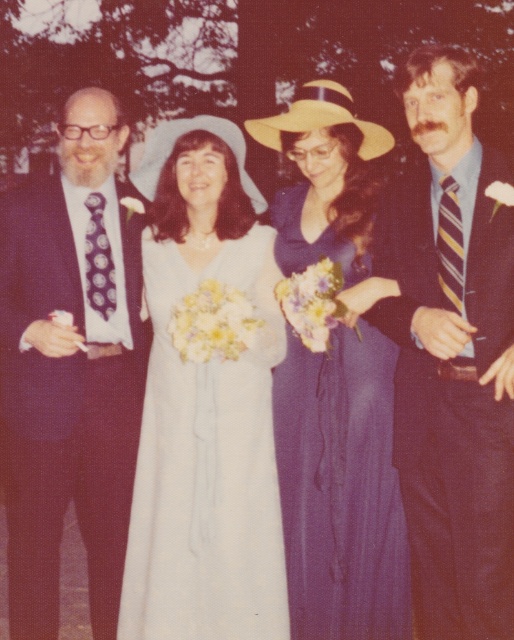
Does striped tie at right have a lesser width compared to matte black suit at left?

Yes, striped tie at right is thinner than matte black suit at left.

Can you confirm if striped tie at right is taller than matte black suit at left?

No, striped tie at right is not taller than matte black suit at left.

Where is `striped tie at right`? The width and height of the screenshot is (514, 640). striped tie at right is located at coordinates (451, 355).

Where is `striped tie at right`? This screenshot has width=514, height=640. striped tie at right is located at coordinates (451, 355).

From the picture: Can you confirm if white satin dress at center is positioned to the right of purple satin dress at center?

Incorrect, white satin dress at center is not on the right side of purple satin dress at center.

Does white satin dress at center have a larger size compared to purple satin dress at center?

Correct, white satin dress at center is larger in size than purple satin dress at center.

Find the location of a particular element. This screenshot has height=640, width=514. white satin dress at center is located at coordinates (207, 467).

Describe the element at coordinates (70, 365) in the screenshot. The image size is (514, 640). I see `matte black suit at left` at that location.

Is matte black suit at left below white satin dress at center?

Actually, matte black suit at left is above white satin dress at center.

Where is `matte black suit at left`? This screenshot has height=640, width=514. matte black suit at left is located at coordinates (70, 365).